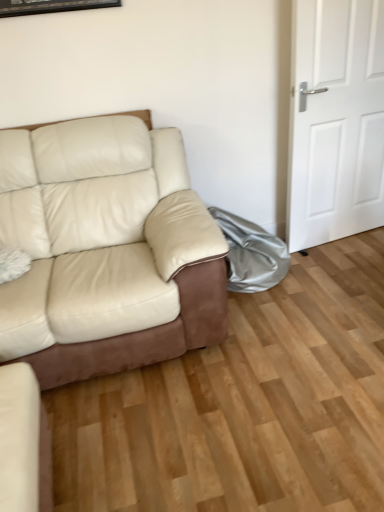
The width and height of the screenshot is (384, 512). In order to click on free location to the right of silver metallic bag at lower right in this screenshot , I will do `click(324, 268)`.